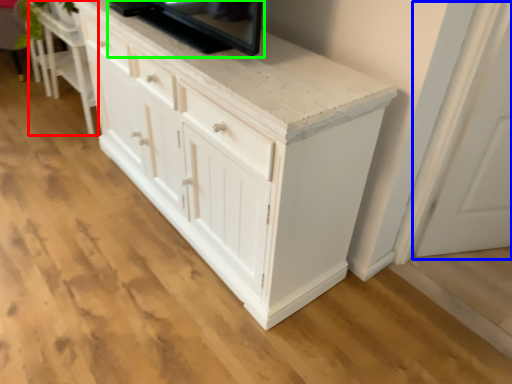
Question: Based on their relative distances, which object is nearer to vanity (highlighted by a red box)? Choose from glass door (highlighted by a blue box) and appliance (highlighted by a green box).

Choices:
 (A) glass door
 (B) appliance

Answer: (B)